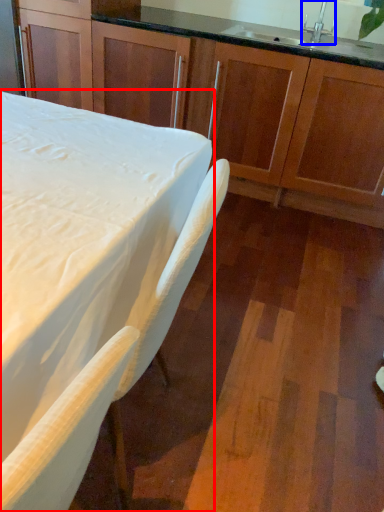
Question: Which object appears farthest to the camera in this image, table (highlighted by a red box) or faucet (highlighted by a blue box)?

Choices:
 (A) table
 (B) faucet

Answer: (B)